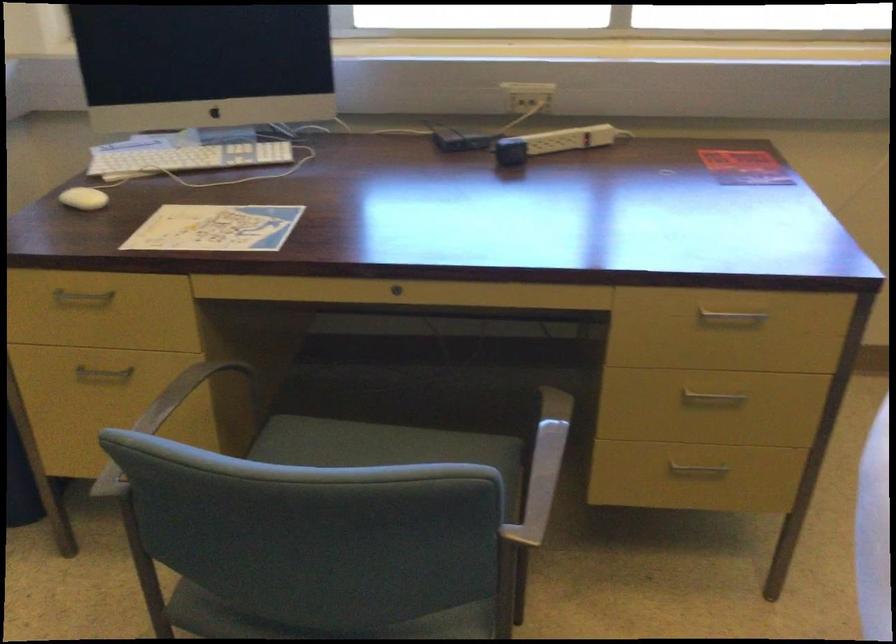
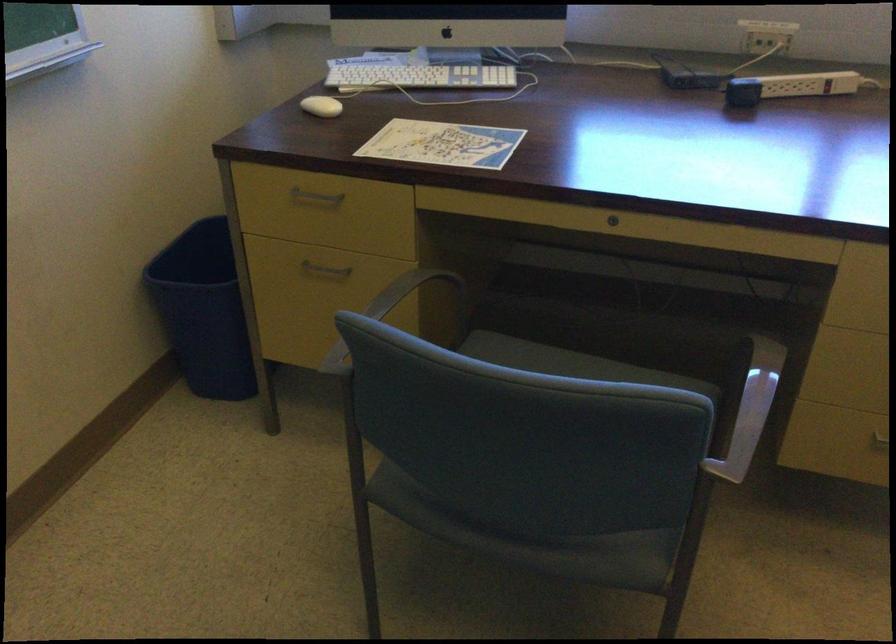
Find the pixel in the second image that matches (84,297) in the first image.

(315, 196)